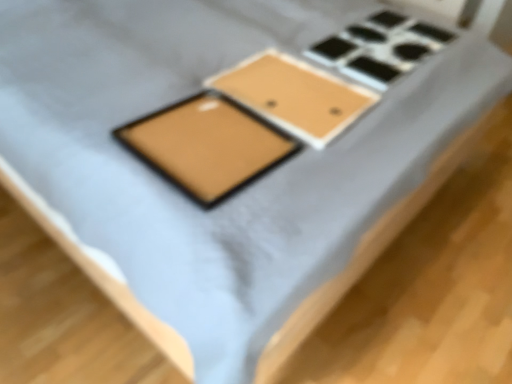
Question: Do you think matte brown tray at center is within matte gold tablet at center, or outside of it?

Choices:
 (A) inside
 (B) outside

Answer: (B)

Question: Is matte brown tray at center in front of or behind matte gold tablet at center in the image?

Choices:
 (A) behind
 (B) front

Answer: (A)

Question: From a real-world perspective, is matte brown tray at center physically located above or below matte gold tablet at center?

Choices:
 (A) above
 (B) below

Answer: (B)

Question: Is matte gold tablet at center spatially inside matte brown tray at center, or outside of it?

Choices:
 (A) inside
 (B) outside

Answer: (B)

Question: Based on their positions, is matte gold tablet at center located to the left or right of matte brown tray at center?

Choices:
 (A) right
 (B) left

Answer: (B)

Question: In terms of height, does matte gold tablet at center look taller or shorter compared to matte brown tray at center?

Choices:
 (A) short
 (B) tall

Answer: (B)

Question: Considering the positions of point (259, 148) and point (304, 114), is point (259, 148) closer or farther from the camera than point (304, 114)?

Choices:
 (A) closer
 (B) farther

Answer: (A)